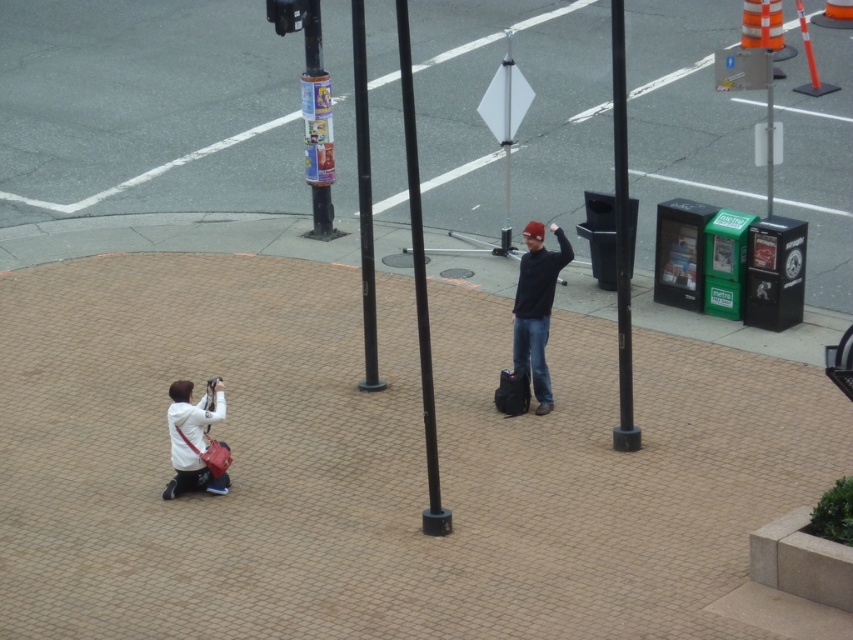
Question: Among these objects, which one is farthest from the camera?

Choices:
 (A) black metal pole at center
 (B) brown textured pavement at lower center

Answer: (A)

Question: Is brown textured pavement at lower center wider than smooth black pole at center?

Choices:
 (A) no
 (B) yes

Answer: (B)

Question: Can you confirm if matte black jacket at center is thinner than black metal pole at center?

Choices:
 (A) no
 (B) yes

Answer: (A)

Question: Which of the following is the farthest from the observer?

Choices:
 (A) (537, 259)
 (B) (438, 500)
 (C) (370, 365)

Answer: (C)

Question: Does black matte pole at center appear on the left side of smooth black pole at center?

Choices:
 (A) yes
 (B) no

Answer: (A)

Question: Which object is the closest to the black metal pole at center?

Choices:
 (A) brown textured pavement at lower center
 (B) black plastic pole at center
 (C) black matte pole at center
 (D) matte black jacket at center

Answer: (D)